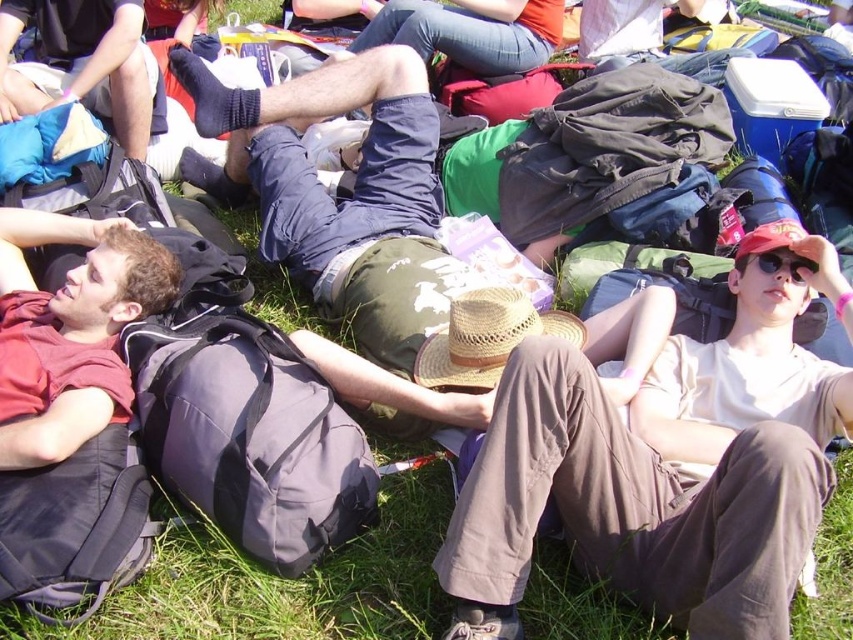
Between matte red shirt at left and matte black sunglasses at center right, which one is positioned lower?

Positioned lower is matte red shirt at left.

Which is more to the left, matte red shirt at left or matte black sunglasses at center right?

Positioned to the left is matte red shirt at left.

Who is more forward, (47, 326) or (746, 260)?

Point (47, 326)

The image size is (853, 640). I want to click on matte red shirt at left, so click(70, 330).

Does matte red shirt at left have a greater width compared to matte black socks at upper left?

No.

Which is more to the left, matte red shirt at left or matte black socks at upper left?

From the viewer's perspective, matte black socks at upper left appears more on the left side.

Where is `matte red shirt at left`? This screenshot has width=853, height=640. matte red shirt at left is located at coordinates (70, 330).

Image resolution: width=853 pixels, height=640 pixels. Identify the location of matte red shirt at left. (70, 330).

In the scene shown: Can you confirm if matte black socks at upper left is positioned to the right of matte black sunglasses at center right?

In fact, matte black socks at upper left is to the left of matte black sunglasses at center right.

Describe the element at coordinates (80, 64) in the screenshot. I see `matte black socks at upper left` at that location.

Image resolution: width=853 pixels, height=640 pixels. What do you see at coordinates (80, 64) in the screenshot? I see `matte black socks at upper left` at bounding box center [80, 64].

What are the coordinates of `matte black socks at upper left` in the screenshot? It's located at (80, 64).